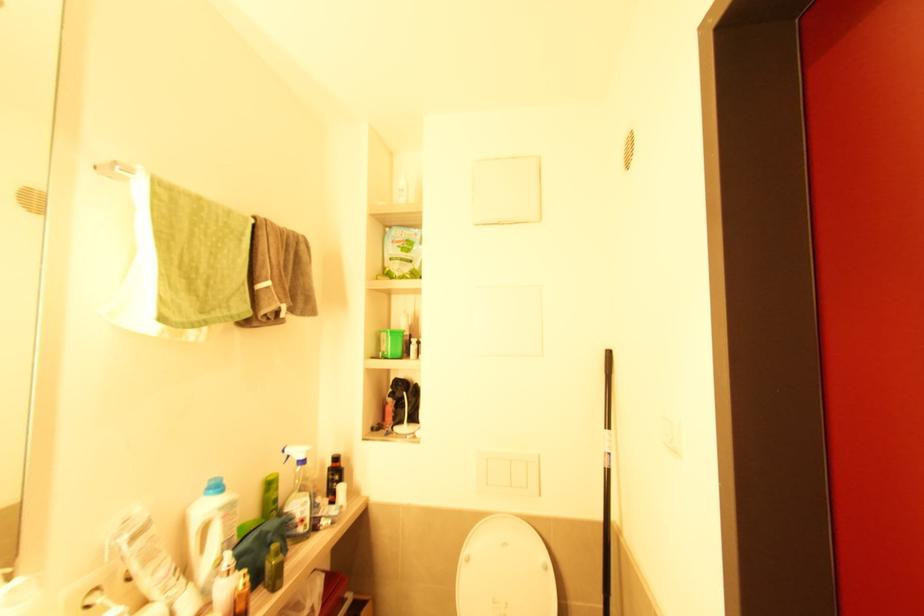
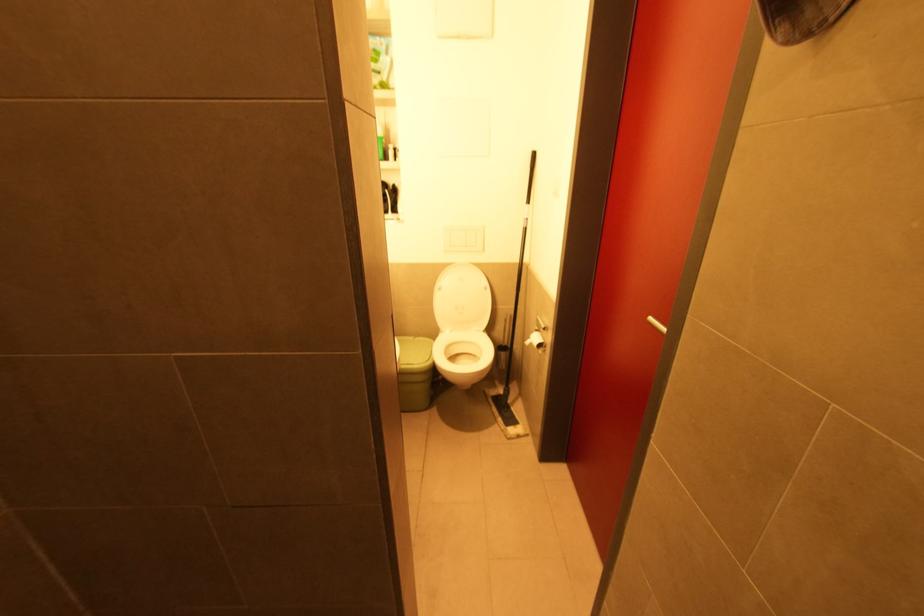
Question: In a continuous first-person perspective shot, in which direction is the camera moving?

Choices:
 (A) Left
 (B) Right
 (C) Forward
 (D) Backward

Answer: (D)